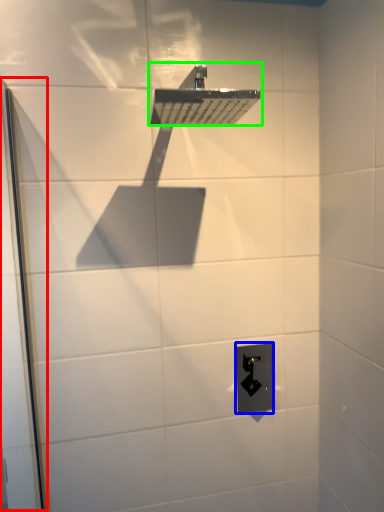
Question: Which is farther away from screen door (highlighted by a red box)? electric outlet (highlighted by a blue box) or shower (highlighted by a green box)?

Choices:
 (A) electric outlet
 (B) shower

Answer: (A)